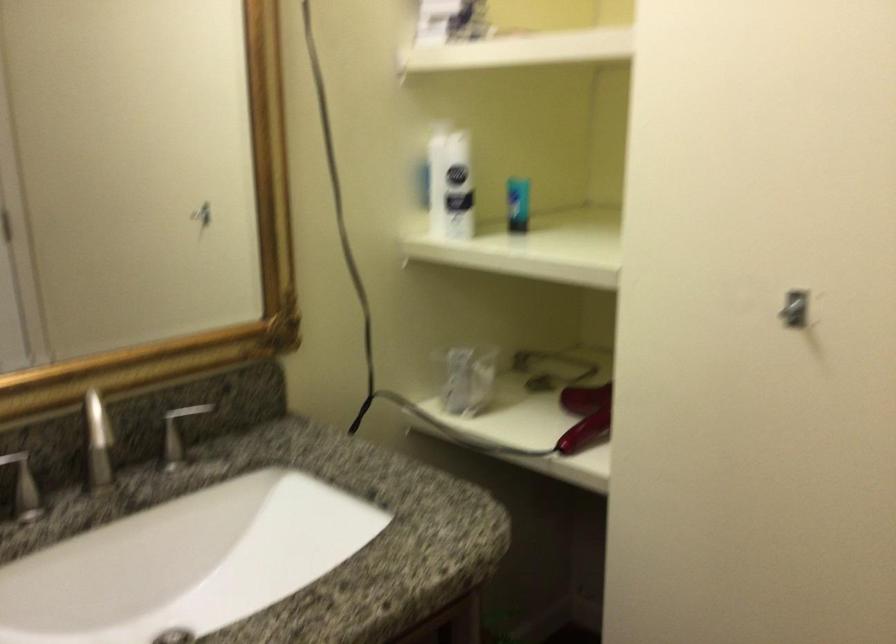
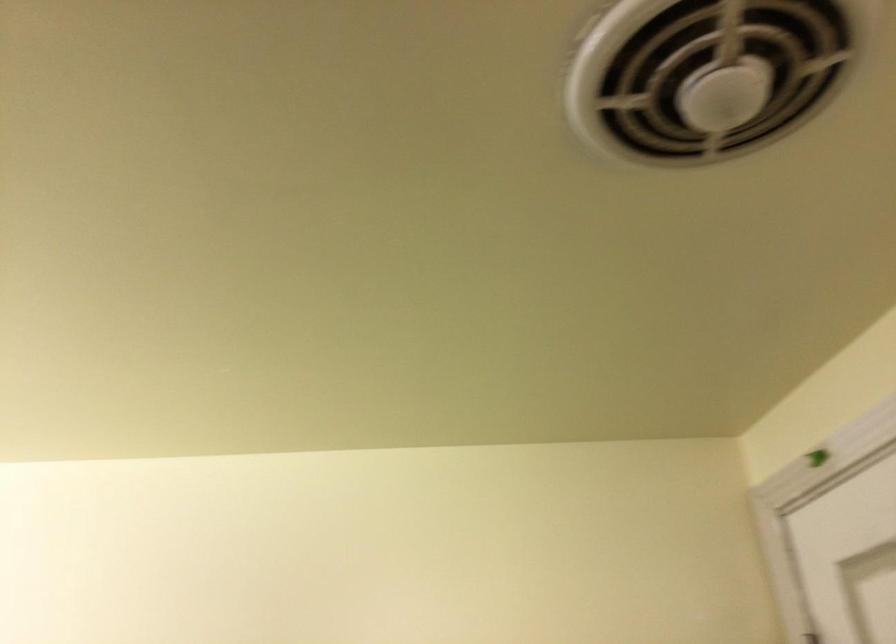
The images are taken continuously from a first-person perspective. In which direction is your viewpoint rotating?

Result: The camera rotated toward right-up.